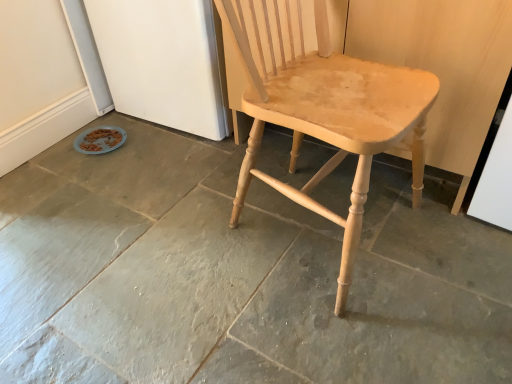
Question: Does natural wood chair at center have a lesser width compared to natural stone floor at center?

Choices:
 (A) yes
 (B) no

Answer: (A)

Question: Is natural wood chair at center placed right next to natural stone floor at center?

Choices:
 (A) yes
 (B) no

Answer: (B)

Question: From a real-world perspective, is natural wood chair at center physically above natural stone floor at center?

Choices:
 (A) no
 (B) yes

Answer: (B)

Question: Considering the relative sizes of natural wood chair at center and natural stone floor at center in the image provided, is natural wood chair at center bigger than natural stone floor at center?

Choices:
 (A) no
 (B) yes

Answer: (B)

Question: Could you tell me if natural wood chair at center is facing natural stone floor at center?

Choices:
 (A) no
 (B) yes

Answer: (A)

Question: From the image's perspective, would you say natural wood chair at center is shown under natural stone floor at center?

Choices:
 (A) yes
 (B) no

Answer: (B)

Question: Is natural stone floor at center in contact with natural wood chair at center?

Choices:
 (A) yes
 (B) no

Answer: (B)

Question: Is natural stone floor at center positioned before natural wood chair at center?

Choices:
 (A) yes
 (B) no

Answer: (B)

Question: Does natural stone floor at center appear on the right side of natural wood chair at center?

Choices:
 (A) yes
 (B) no

Answer: (B)

Question: Does natural stone floor at center appear on the left side of natural wood chair at center?

Choices:
 (A) no
 (B) yes

Answer: (B)

Question: Is natural stone floor at center turned away from natural wood chair at center?

Choices:
 (A) no
 (B) yes

Answer: (A)

Question: Considering the relative sizes of natural stone floor at center and natural wood chair at center in the image provided, is natural stone floor at center thinner than natural wood chair at center?

Choices:
 (A) no
 (B) yes

Answer: (A)

Question: Is point (96, 375) positioned closer to the camera than point (279, 26)?

Choices:
 (A) closer
 (B) farther

Answer: (A)